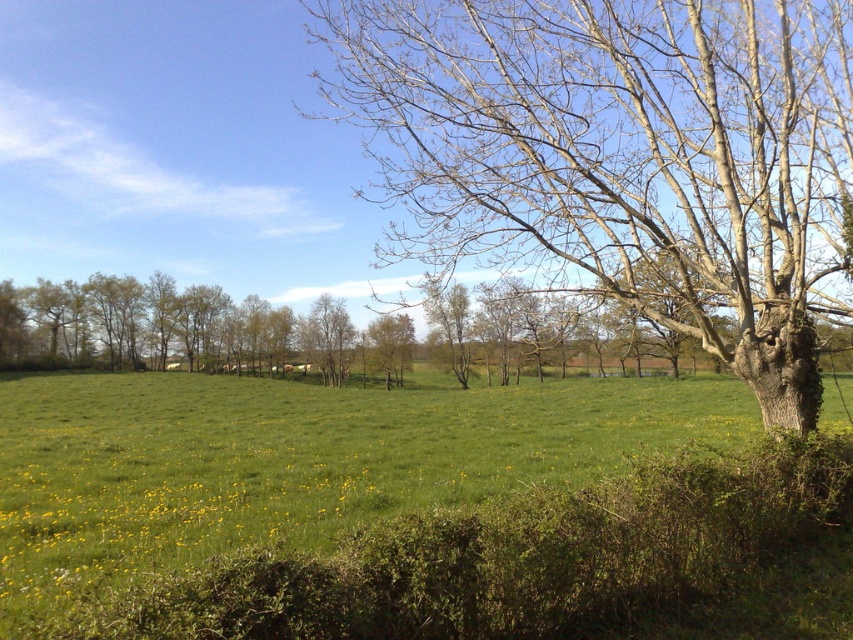
Question: In this image, where is bare wood tree at center located relative to green leafy tree at center?

Choices:
 (A) right
 (B) left

Answer: (A)

Question: Considering the real-world distances, which object is farthest from the bare wood tree at center?

Choices:
 (A) green grassy pasture at center
 (B) green leafy tree at center

Answer: (B)

Question: In this image, where is bare wood tree at center located relative to green grassy pasture at center?

Choices:
 (A) above
 (B) below

Answer: (A)

Question: Which object appears farthest from the camera in this image?

Choices:
 (A) bare wood tree at center
 (B) green leafy tree at center
 (C) green grassy pasture at center

Answer: (B)

Question: From the image, what is the correct spatial relationship of green grassy pasture at center in relation to green leafy tree at center?

Choices:
 (A) left
 (B) right

Answer: (A)

Question: Which object is farther from the camera taking this photo?

Choices:
 (A) bare wood tree at center
 (B) green leafy tree at center

Answer: (B)